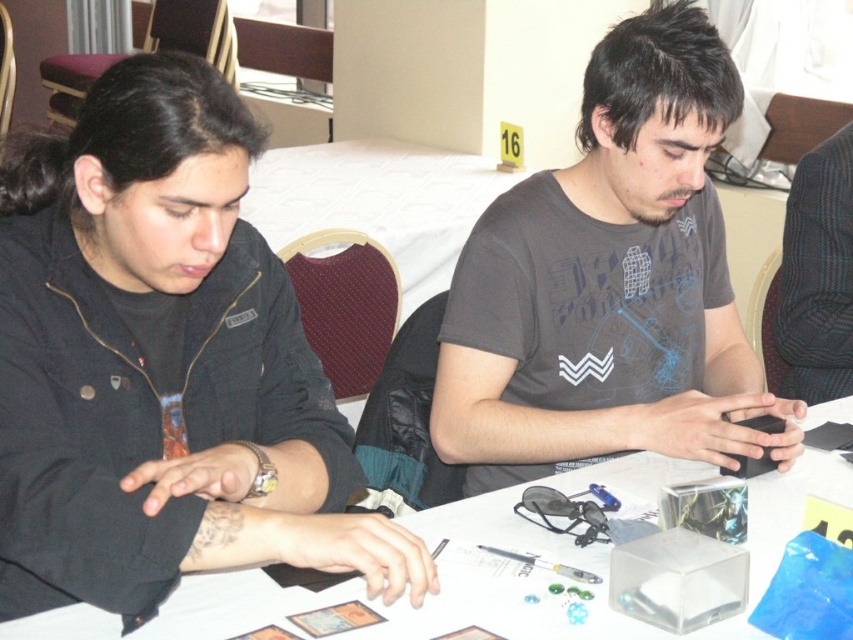
You are a photographer trying to capture a candid shot of the person in the black matte jacket at upper left. The camera you are using has a minimum focusing distance of 36 inches. Can you take the photo without moving either the camera or the jacket?

The black matte jacket at upper left and camera are 35.89 inches apart, which is less than the camera minimum focusing distance of 36 inches. Therefore, you cannot take the photo without moving either the camera or the jacket.

Looking at this image, you are a photographer trying to capture a closeup shot of the white paper at center. You notice the black matte jacket at upper left is blocking your view. Can you estimate whether the jacket is tall enough to obstruct the paper?

A: The black matte jacket at upper left is much taller than the white paper at center, so it will obstruct the view of the white paper at center.